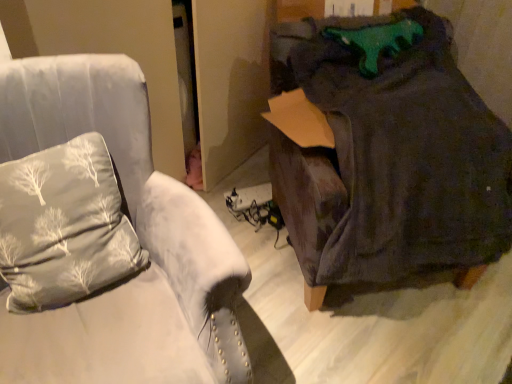
Question: Should I look upward or downward to see velvet gray armchair at left?

Choices:
 (A) down
 (B) up

Answer: (A)

Question: From the image's perspective, is silky gray pillow at left above velvet gray armchair at left?

Choices:
 (A) no
 (B) yes

Answer: (B)

Question: Is silky gray pillow at left beside velvet gray armchair at left?

Choices:
 (A) no
 (B) yes

Answer: (A)

Question: Would you consider silky gray pillow at left to be distant from velvet gray armchair at left?

Choices:
 (A) yes
 (B) no

Answer: (B)

Question: From a real-world perspective, is silky gray pillow at left below velvet gray armchair at left?

Choices:
 (A) yes
 (B) no

Answer: (B)

Question: Does silky gray pillow at left have a greater height compared to velvet gray armchair at left?

Choices:
 (A) yes
 (B) no

Answer: (B)

Question: Does silky gray pillow at left lie behind velvet gray armchair at left?

Choices:
 (A) no
 (B) yes

Answer: (B)

Question: Would you say dark gray fabric bean bag at right is outside velvet gray armchair at left?

Choices:
 (A) no
 (B) yes

Answer: (B)

Question: Does dark gray fabric bean bag at right have a lesser height compared to velvet gray armchair at left?

Choices:
 (A) no
 (B) yes

Answer: (B)

Question: Is dark gray fabric bean bag at right beside velvet gray armchair at left?

Choices:
 (A) no
 (B) yes

Answer: (A)

Question: From the image's perspective, is dark gray fabric bean bag at right beneath velvet gray armchair at left?

Choices:
 (A) no
 (B) yes

Answer: (A)

Question: Is dark gray fabric bean bag at right positioned with its back to velvet gray armchair at left?

Choices:
 (A) yes
 (B) no

Answer: (B)

Question: Is dark gray fabric bean bag at right further to camera compared to velvet gray armchair at left?

Choices:
 (A) no
 (B) yes

Answer: (B)

Question: Is velvet gray armchair at left aimed at silky gray pillow at left?

Choices:
 (A) yes
 (B) no

Answer: (A)